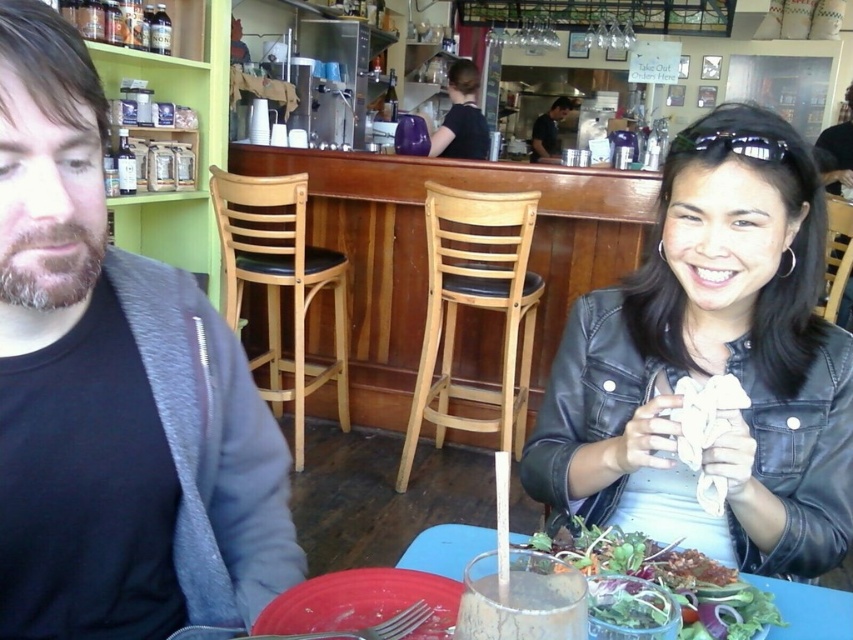
Question: Which point appears closest to the camera in this image?

Choices:
 (A) (676, 147)
 (B) (180, 492)

Answer: (B)

Question: Can you confirm if black leather jacket at lower right is wider than red matte plate at lower left?

Choices:
 (A) no
 (B) yes

Answer: (B)

Question: Does black matte jacket at left appear under black leather jacket at center?

Choices:
 (A) no
 (B) yes

Answer: (B)

Question: Can you confirm if fresh green salad at lower center is positioned above red matte plate at lower left?

Choices:
 (A) yes
 (B) no

Answer: (B)

Question: Which object is closer to the camera taking this photo?

Choices:
 (A) red matte plate at lower left
 (B) fresh green salad at lower center
 (C) black leather jacket at center
 (D) black matte jacket at left

Answer: (D)

Question: Which point is farther from the camera taking this photo?

Choices:
 (A) (350, 618)
 (B) (650, 333)

Answer: (B)